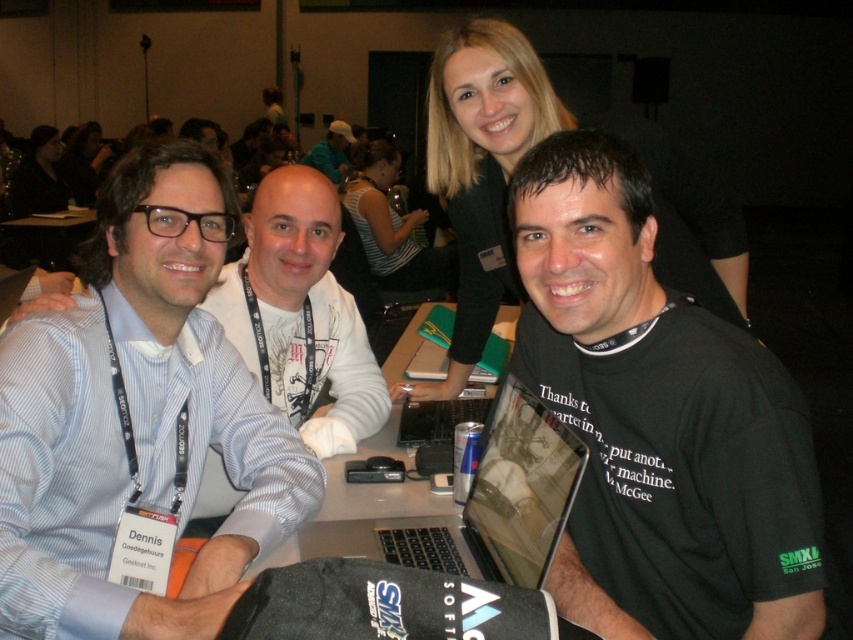
Does blue striped shirt at center appear on the left side of green fabric cap at upper center?

Incorrect, blue striped shirt at center is not on the left side of green fabric cap at upper center.

Describe the element at coordinates (137, 417) in the screenshot. I see `blue striped shirt at center` at that location.

Identify the location of blue striped shirt at center. The width and height of the screenshot is (853, 640). (137, 417).

What do you see at coordinates (137, 417) in the screenshot? I see `blue striped shirt at center` at bounding box center [137, 417].

Who is shorter, blue striped shirt at center or striped fabric shirt at center?

Standing shorter between the two is blue striped shirt at center.

Which is behind, point (158, 499) or point (402, 250)?

The point (402, 250) is more distant.

At what (x,y) coordinates should I click in order to perform the action: click on blue striped shirt at center. Please return your answer as a coordinate pair (x, y). This screenshot has height=640, width=853. Looking at the image, I should click on click(137, 417).

Does blue striped shirt at center appear on the right side of blonde hair at upper center?

Incorrect, blue striped shirt at center is not on the right side of blonde hair at upper center.

Does blue striped shirt at center appear over blonde hair at upper center?

Incorrect, blue striped shirt at center is not positioned above blonde hair at upper center.

What do you see at coordinates (137, 417) in the screenshot? I see `blue striped shirt at center` at bounding box center [137, 417].

Identify the location of blue striped shirt at center. This screenshot has height=640, width=853. point(137,417).